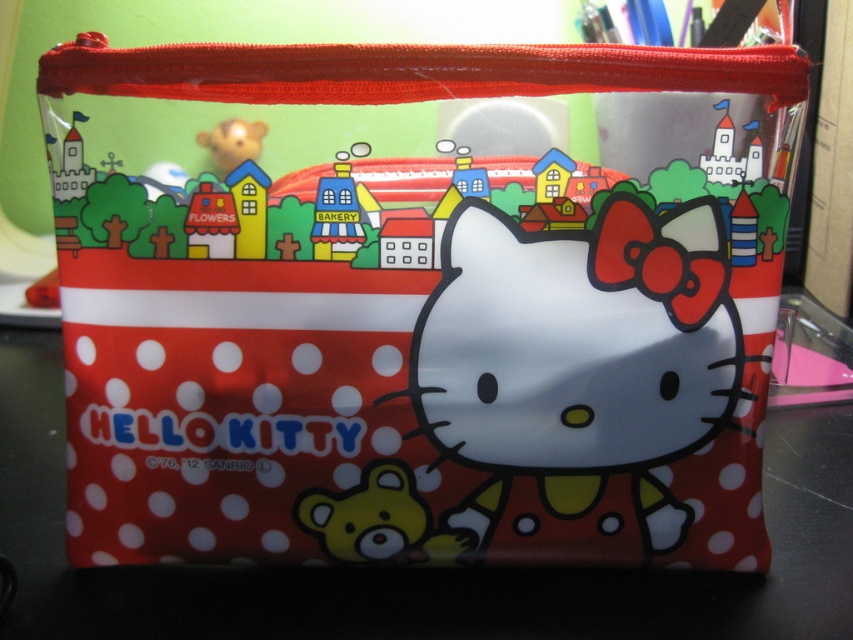
Question: Can you confirm if yellow matte bear at center is positioned to the right of matte plastic bakery at center?

Choices:
 (A) yes
 (B) no

Answer: (A)

Question: Which of these objects is positioned closest to the matte plastic bear at upper left?

Choices:
 (A) yellow matte bear at center
 (B) matte yellow bear at center
 (C) matte plastic bakery at center

Answer: (B)

Question: Can you confirm if white glossy cat at center is bigger than yellow matte bear at center?

Choices:
 (A) yes
 (B) no

Answer: (A)

Question: Which of the following is the closest to the observer?

Choices:
 (A) (325, 225)
 (B) (225, 253)
 (C) (523, 500)
 (D) (378, 474)

Answer: (A)

Question: Is matte plastic bakery at center to the right of matte yellow house at center from the viewer's perspective?

Choices:
 (A) no
 (B) yes

Answer: (A)

Question: Estimate the real-world distances between objects in this image. Which object is closer to the white glossy cat at center?

Choices:
 (A) matte yellow bear at center
 (B) yellow matte bear at center

Answer: (B)